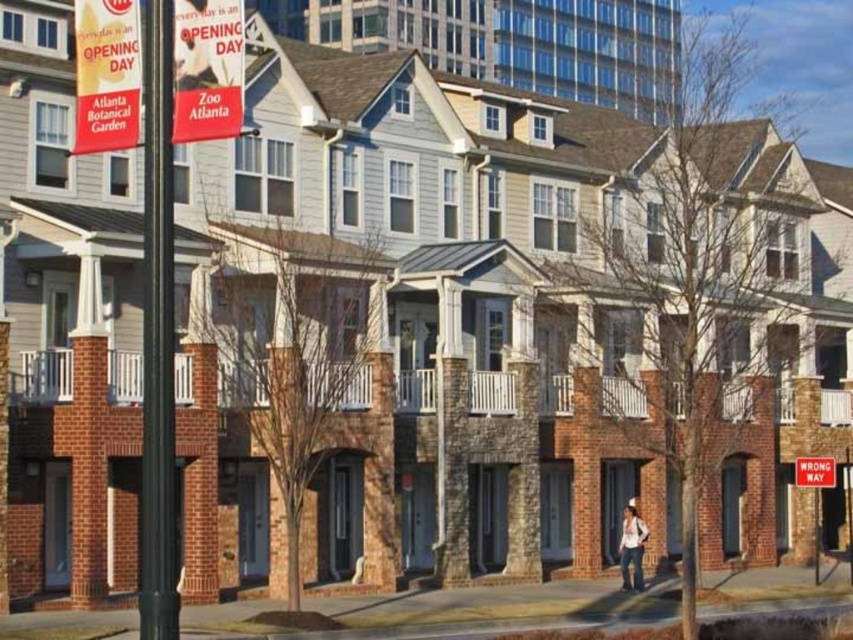
Does white cotton shirt at lower right have a greater height compared to wrong way sign at lower right?

Correct, white cotton shirt at lower right is much taller as wrong way sign at lower right.

In the scene shown: Which is more to the right, white cotton shirt at lower right or wrong way sign at lower right?

From the viewer's perspective, wrong way sign at lower right appears more on the right side.

Describe the element at coordinates (631, 548) in the screenshot. The width and height of the screenshot is (853, 640). I see `white cotton shirt at lower right` at that location.

What are the coordinates of `white cotton shirt at lower right` in the screenshot? It's located at (631, 548).